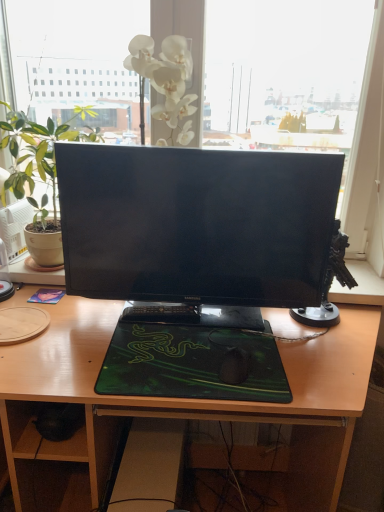
You are a GUI agent. You are given a task and a screenshot of the screen. Output one action in this format:
    pyautogui.click(x=<x>, y=<y>)
    Task: Click on the free space above green matte mousepad at center (from a real-world perspective)
    This screenshot has height=512, width=384.
    Given the screenshot: What is the action you would take?
    pyautogui.click(x=195, y=349)